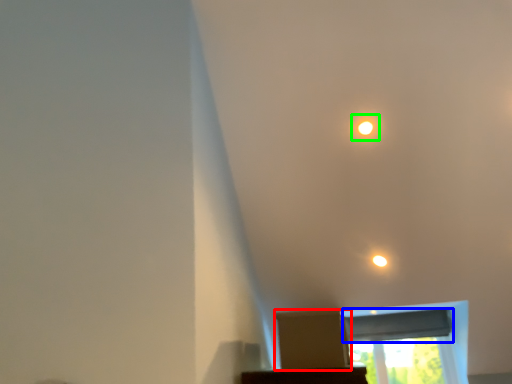
Question: Which is nearer to the cardboard box (highlighted by a red box)? window screen (highlighted by a blue box) or dot (highlighted by a green box).

Choices:
 (A) window screen
 (B) dot

Answer: (B)